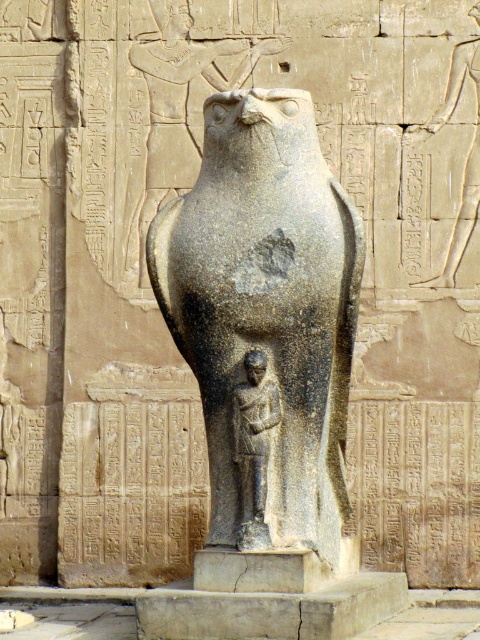
Looking at this image, you are an archaeologist examining the image of the ancient Egyptian sculpture. You need to locate the granite statue of falcon at center precisely. What are its coordinates?

The granite statue of falcon at center is located at coordinates point (265, 317).

You are an archaeologist examining the statue. You notice that the granite statue of falcon at center and the dark gray stone figure at center are positioned in a specific way. Which one is located to the left side of the other?

The granite statue of falcon at center is to the left of dark gray stone figure at center.